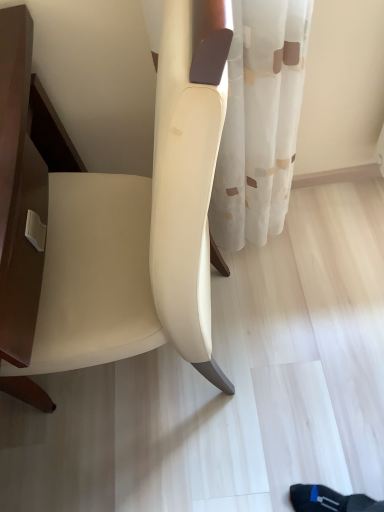
The image size is (384, 512). Find the location of `free space to the right of matte white chair at left`. free space to the right of matte white chair at left is located at coordinates (306, 311).